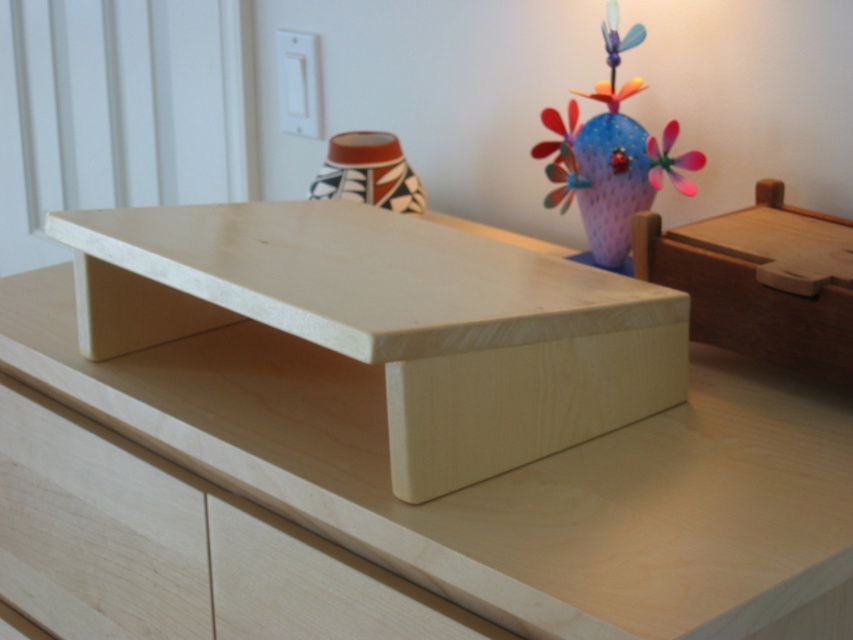
In the scene shown: You are organizing a small item on the light wooden shelf. The item is 10 cm tall. You have two options to place it on the natural wood drawer at center or the matte plastic flower at upper right. Which object can accommodate the item without it exceeding its height?

The natural wood drawer at center has a greater height compared to the matte plastic flower at upper right, so the item can be placed on the natural wood drawer at center without exceeding its height.

You are organizing items on a minimalist wooden shelf. You have a natural wood drawer at lower left and a wooden puzzle box at right. Which object is taller?

The natural wood drawer at lower left is taller than the wooden puzzle box at right.

You are standing in the room and see two points marked on the wall. The first point is at coordinate point (73, 467) and the second is at point (606, 84). Which point is closer to you?

Point (73, 467) is in front of point (606, 84), so it is closer to you.